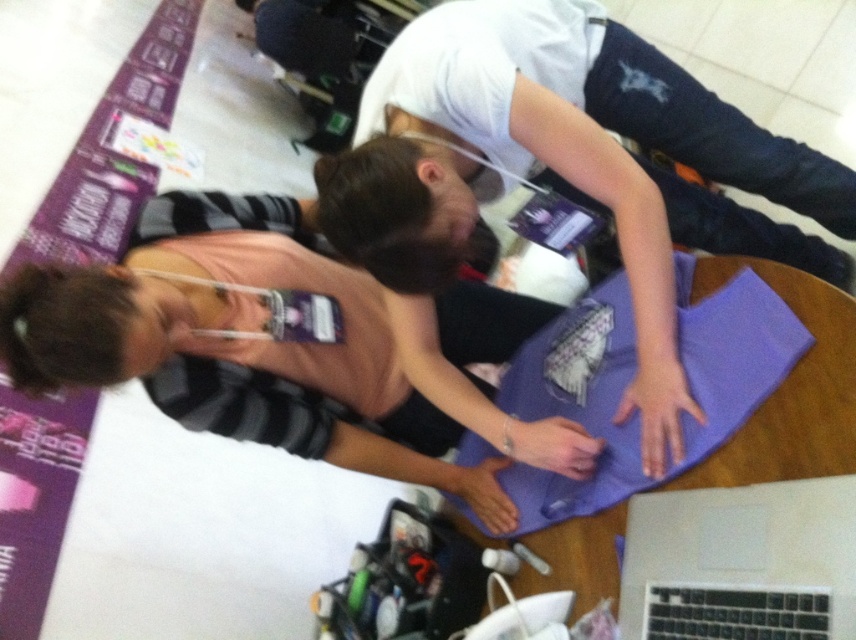
Question: Which point is farther to the camera?

Choices:
 (A) (813, 592)
 (B) (604, 448)

Answer: (B)

Question: Among these points, which one is farthest from the camera?

Choices:
 (A) (565, 420)
 (B) (601, 342)
 (C) (711, 509)

Answer: (B)

Question: Is pink fabric at center further to camera compared to silver metallic laptop at lower right?

Choices:
 (A) yes
 (B) no

Answer: (A)

Question: Which object is positioned farthest from the purple fabric at center?

Choices:
 (A) silver metallic laptop at lower right
 (B) pink fabric at center

Answer: (B)

Question: Is purple fabric at center to the right of silver metallic laptop at lower right from the viewer's perspective?

Choices:
 (A) yes
 (B) no

Answer: (B)

Question: Does purple fabric at center appear over silver metallic laptop at lower right?

Choices:
 (A) no
 (B) yes

Answer: (B)